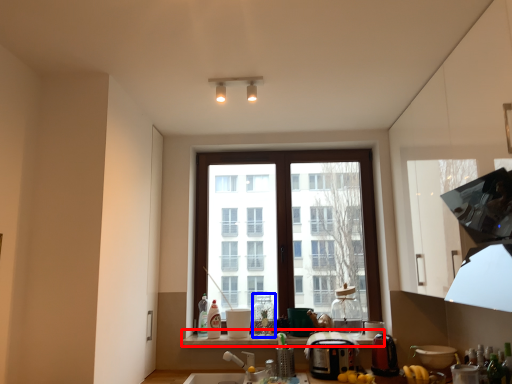
Question: Among these objects, which one is farthest to the camera, window sill (highlighted by a red box) or bottle (highlighted by a blue box)?

Choices:
 (A) window sill
 (B) bottle

Answer: (B)